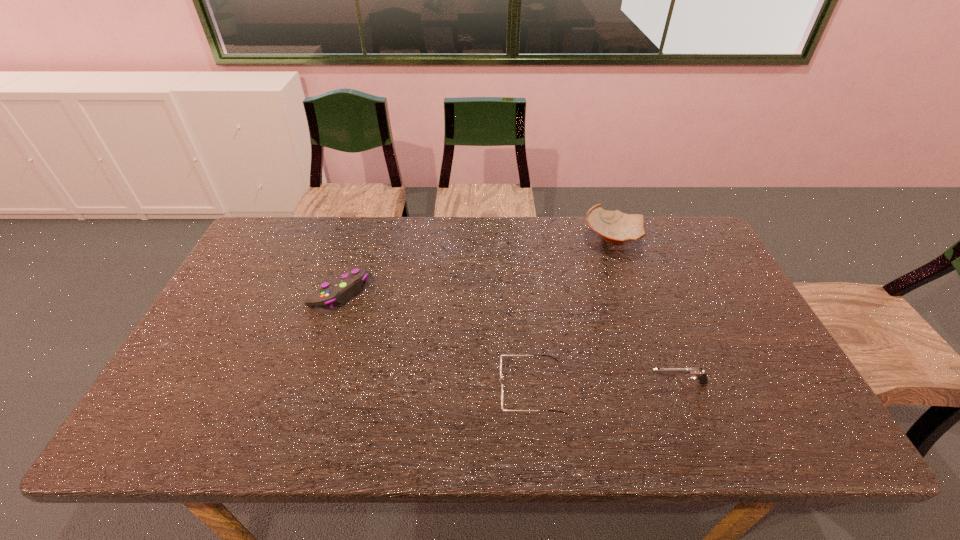
In order to click on free location at the far left corner in this screenshot , I will do `click(248, 249)`.

What are the coordinates of `vacant space at the far right corner of the desktop` in the screenshot? It's located at (701, 260).

The image size is (960, 540). Find the location of `vacant space that's between the second object from left to right and the leftmost object`. vacant space that's between the second object from left to right and the leftmost object is located at coordinates (436, 340).

The width and height of the screenshot is (960, 540). What are the coordinates of `vacant area that lies between the tallest object and the pistol` in the screenshot? It's located at (645, 311).

This screenshot has width=960, height=540. I want to click on vacant area that lies between the control and the pistol, so click(x=509, y=338).

The height and width of the screenshot is (540, 960). Find the location of `empty space that is in between the third nearest object and the pistol`. empty space that is in between the third nearest object and the pistol is located at coordinates (509, 338).

Where is `free spot between the pistol and the control`? The image size is (960, 540). free spot between the pistol and the control is located at coordinates (509, 338).

At what (x,y) coordinates should I click in order to perform the action: click on empty space between the spectacles and the pistol. Please return your answer as a coordinate pair (x, y). The height and width of the screenshot is (540, 960). Looking at the image, I should click on (604, 386).

I want to click on unoccupied position between the second farthest object and the spectacles, so click(x=436, y=340).

Where is `free space between the farthest object and the third object from right to left`? This screenshot has width=960, height=540. free space between the farthest object and the third object from right to left is located at coordinates (572, 314).